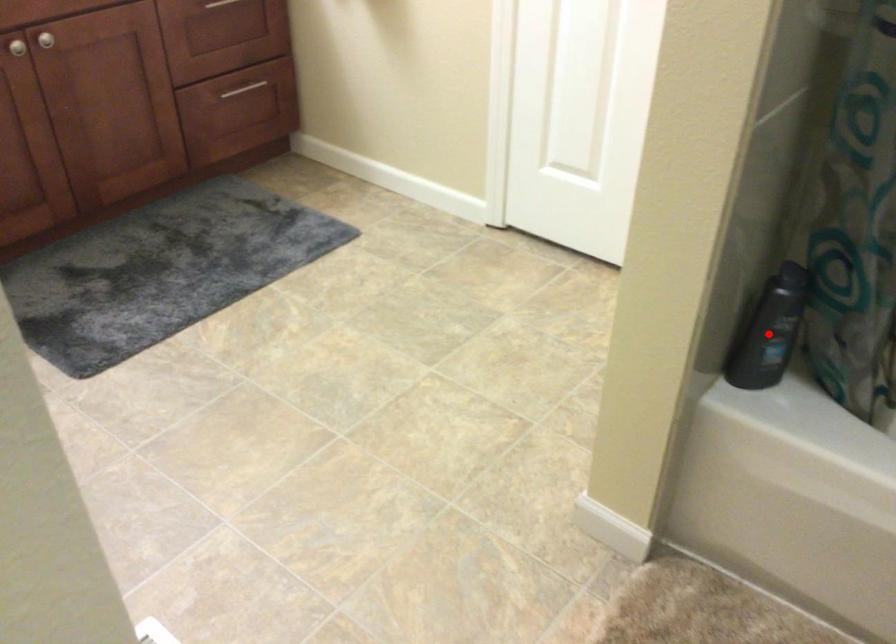
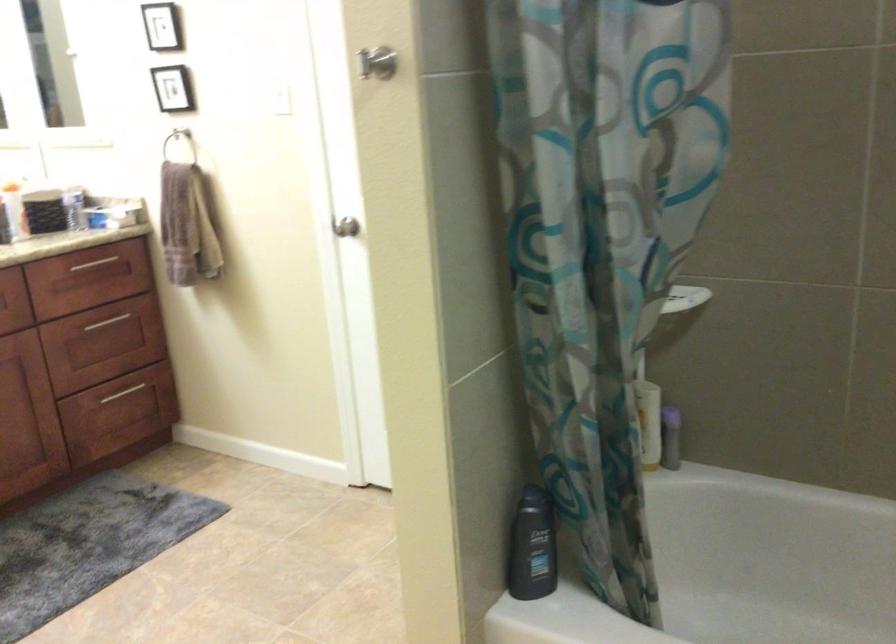
Question: A red point is marked in image1. In image2, is the corresponding 3D point closer to the camera or farther? Reply with the corresponding letter.

Choices:
 (A) The corresponding 3D point is closer.
 (B) The corresponding 3D point is farther.

Answer: (B)